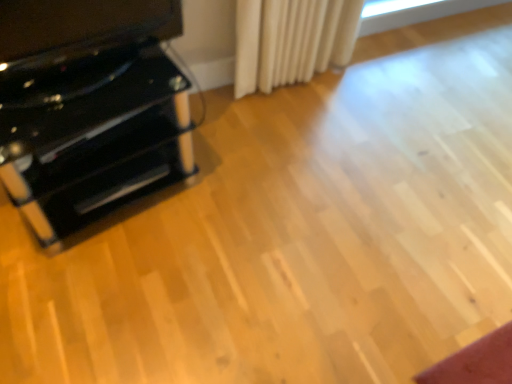
What are the coordinates of `free space in front of glossy black cabinet at left` in the screenshot? It's located at (97, 324).